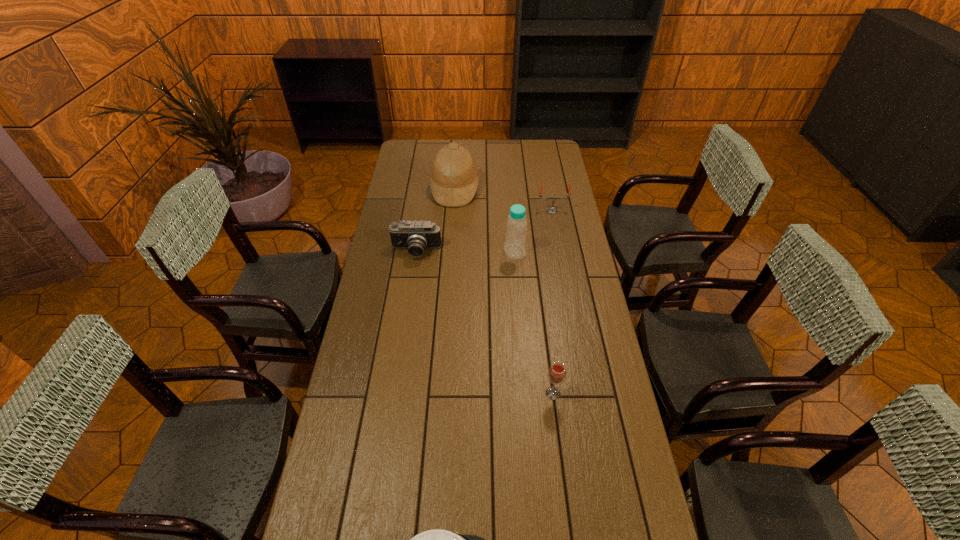
This screenshot has height=540, width=960. I want to click on the taller hat, so click(454, 181).

Where is `the fourth object from left to right`? the fourth object from left to right is located at coordinates (516, 227).

Locate an element on the screen. The width and height of the screenshot is (960, 540). candle is located at coordinates (552, 209).

The image size is (960, 540). I want to click on the second nearest object, so click(557, 373).

The width and height of the screenshot is (960, 540). In order to click on the fifth object from left to right in this screenshot , I will do `click(557, 373)`.

Image resolution: width=960 pixels, height=540 pixels. I want to click on camera, so click(x=416, y=236).

Locate an element on the screen. The height and width of the screenshot is (540, 960). blank space located 0.310m on the front-facing side of the taller hat is located at coordinates (544, 190).

This screenshot has width=960, height=540. Find the location of `vacant point located 0.400m on the front of the fourth object from left to right`. vacant point located 0.400m on the front of the fourth object from left to right is located at coordinates (522, 345).

The height and width of the screenshot is (540, 960). In order to click on blank space located 0.120m on the front-facing side of the candle in this screenshot , I will do `click(556, 232)`.

In order to click on free region located on the back of the second nearest object in this screenshot , I will do `click(545, 333)`.